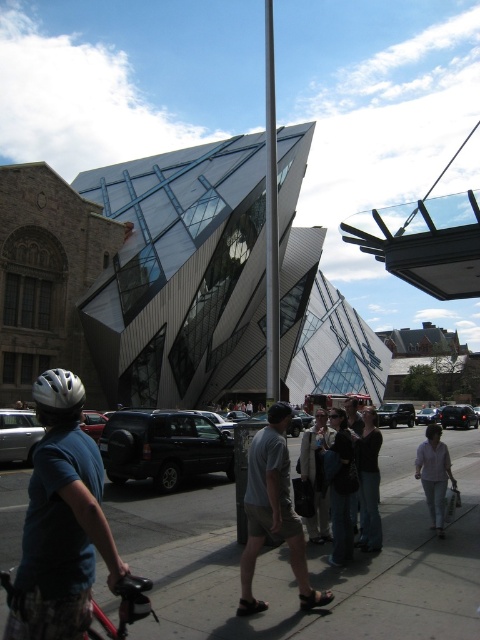
Question: Which of these objects is positioned closest to the light pink shirt at center?

Choices:
 (A) dark gray sweater at center
 (B) white matte bicycle helmet at lower left
 (C) dark blue jeans at center
 (D) gray concrete sidewalk at center

Answer: (C)

Question: Does gray fabric shorts at center appear on the left side of white cotton shirt at center?

Choices:
 (A) no
 (B) yes

Answer: (B)

Question: Based on their relative distances, which object is farther from the white matte bicycle helmet at lower left?

Choices:
 (A) red matte bicycle at lower left
 (B) dark gray sweater at center
 (C) glassy steel building at center
 (D) gray fabric shorts at center

Answer: (C)

Question: Which point is closer to the camera?

Choices:
 (A) pyautogui.click(x=330, y=540)
 (B) pyautogui.click(x=332, y=557)
 (C) pyautogui.click(x=375, y=458)
 (D) pyautogui.click(x=271, y=288)

Answer: (B)

Question: Is dark blue jeans at center bigger than white matte bicycle helmet at lower left?

Choices:
 (A) no
 (B) yes

Answer: (A)

Question: Can you confirm if white cotton shirt at center is bigger than light pink shirt at center?

Choices:
 (A) no
 (B) yes

Answer: (A)